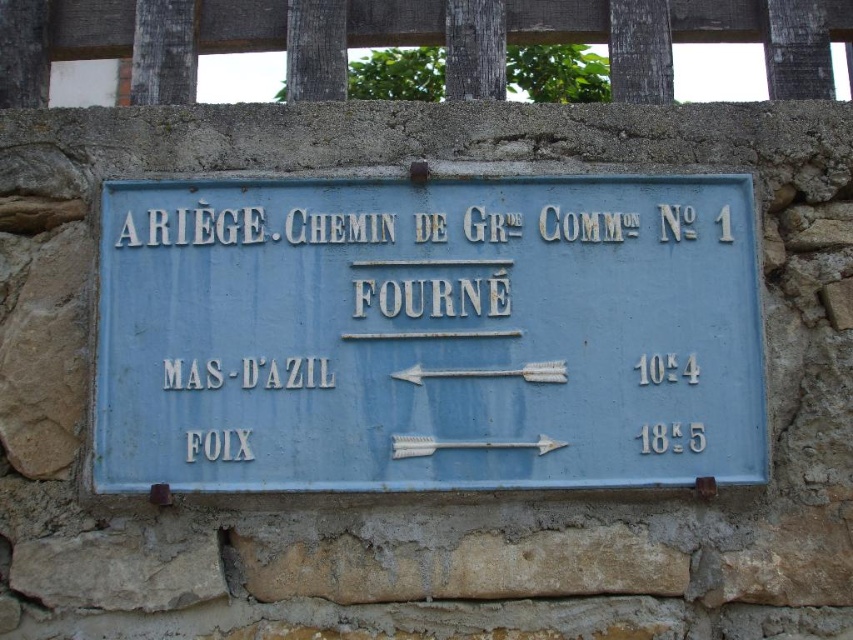
Does wooden slats at upper center appear on the right side of white metallic arrow at center?

Incorrect, wooden slats at upper center is not on the right side of white metallic arrow at center.

Is point (409, 26) closer to viewer compared to point (561, 378)?

No, (409, 26) is further to viewer.

At what (x,y) coordinates should I click in order to perform the action: click on wooden slats at upper center. Please return your answer as a coordinate pair (x, y). The image size is (853, 640). Looking at the image, I should click on (57, 38).

Which is more to the right, blue painted metal sign at center or white metallic arrow at center?

white metallic arrow at center is more to the right.

The image size is (853, 640). What do you see at coordinates (427, 332) in the screenshot? I see `blue painted metal sign at center` at bounding box center [427, 332].

This screenshot has height=640, width=853. Describe the element at coordinates (427, 332) in the screenshot. I see `blue painted metal sign at center` at that location.

You are a GUI agent. You are given a task and a screenshot of the screen. Output one action in this format:
    pyautogui.click(x=<x>, y=<y>)
    Task: Click on the blue painted metal sign at center
    The image size is (853, 640).
    Given the screenshot: What is the action you would take?
    pyautogui.click(x=427, y=332)

Measure the distance from wooden slats at upper center to metallic silver arrow at center.

wooden slats at upper center is 4.40 meters from metallic silver arrow at center.

What do you see at coordinates (57, 38) in the screenshot? The height and width of the screenshot is (640, 853). I see `wooden slats at upper center` at bounding box center [57, 38].

I want to click on wooden slats at upper center, so click(57, 38).